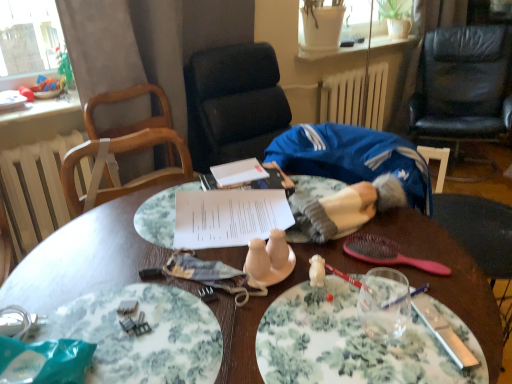
This screenshot has height=384, width=512. I want to click on vacant area that is situated to the right of silver metallic knife at lower right, so click(480, 320).